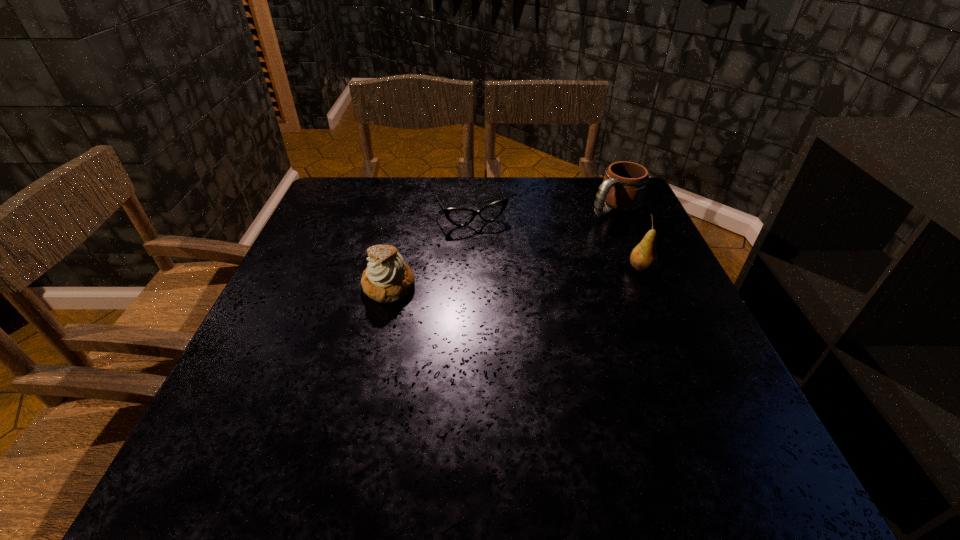
Where is `vacant region located on the front-facing side of the third object from right to left`? This screenshot has width=960, height=540. vacant region located on the front-facing side of the third object from right to left is located at coordinates (510, 280).

Locate an element on the screen. This screenshot has width=960, height=540. blank space located 0.260m on the front-facing side of the third object from right to left is located at coordinates (517, 294).

Locate an element on the screen. This screenshot has height=540, width=960. free region located on the front-facing side of the third object from right to left is located at coordinates (517, 294).

Image resolution: width=960 pixels, height=540 pixels. Identify the location of mug that is at the far edge. pos(624,185).

The image size is (960, 540). Identify the location of spectacles that is at the far edge. (459, 217).

At what (x,y) coordinates should I click in order to perform the action: click on pear that is at the right edge. Please return your answer as a coordinate pair (x, y). Looking at the image, I should click on (643, 258).

Identify the location of mug positioned at the right edge. The width and height of the screenshot is (960, 540). (624, 185).

The height and width of the screenshot is (540, 960). Identify the location of object located in the far right corner section of the desktop. (624, 185).

The image size is (960, 540). I want to click on vacant region at the far edge of the desktop, so click(x=551, y=217).

In the image, there is a desktop. Identify the location of vacant area at the near edge. (583, 390).